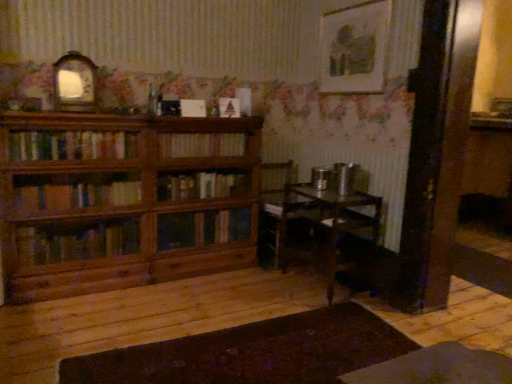
At what (x,y) coordinates should I click in order to perform the action: click on free space above matte white picture frame at upper right, marked as the 2th picture frame in a left-to-right arrangement (from a real-world perspective). Please return your answer as a coordinate pair (x, y). Looking at the image, I should click on (357, 4).